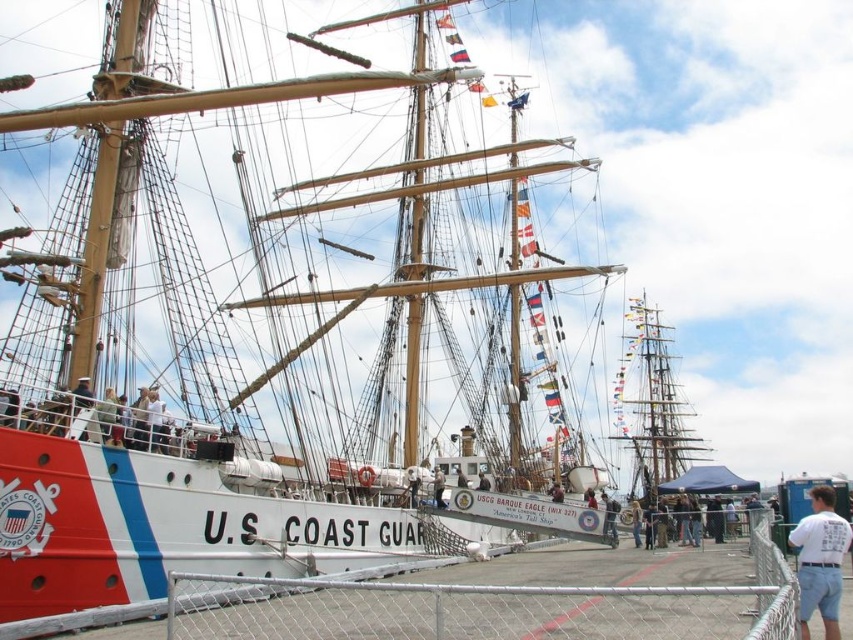
Is white t-shirt at center positioned behind dark blue uniform at center?

That is False.

Is point (809, 531) positioned before point (485, 481)?

Yes, it is in front of point (485, 481).

Locate an element on the screen. This screenshot has height=640, width=853. white t-shirt at center is located at coordinates (820, 561).

Who is shorter, white t-shirt at center or white fabric shirt at center?

white fabric shirt at center is shorter.

At what (x,y) coordinates should I click in order to perform the action: click on white t-shirt at center. Please return your answer as a coordinate pair (x, y). Looking at the image, I should click on (820, 561).

Locate an element on the screen. The image size is (853, 640). white t-shirt at center is located at coordinates (820, 561).

This screenshot has width=853, height=640. What do you see at coordinates (438, 486) in the screenshot?
I see `white fabric shirt at center` at bounding box center [438, 486].

Measure the distance between white fabric shirt at center and white cotton shirt at center.

The distance of white fabric shirt at center from white cotton shirt at center is 23.72 meters.

Is point (436, 476) positioned in front of point (589, 493)?

That is True.

Locate an element on the screen. The height and width of the screenshot is (640, 853). white fabric shirt at center is located at coordinates (438, 486).